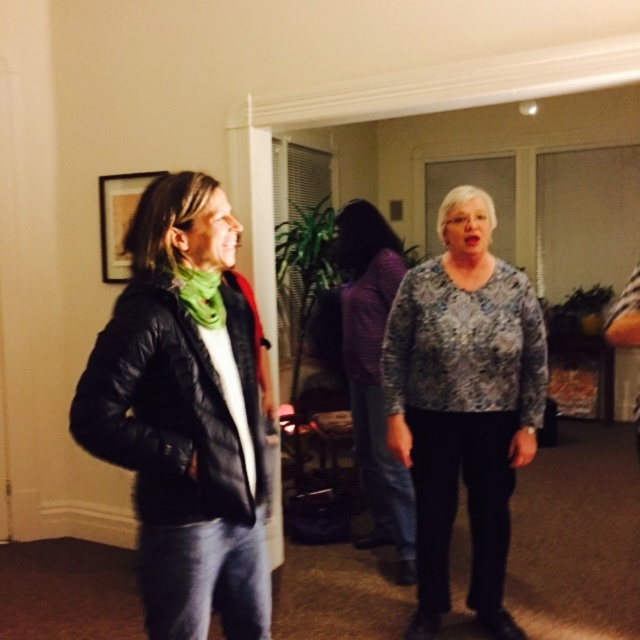
Based on the photo, based on the scene description, where exactly is the black quilted jacket at left located in the image?

The black quilted jacket at left is located at point coordinates of 0.647 on the x axis and 0.291 on the y axis.

You are planning to hang a picture frame on the wall between the black quilted jacket at left and the printed fabric blouse at center. The frame requires at least 1.2 meters of vertical space. Can the space between them accommodate the frame?

The black quilted jacket at left is shorter than the printed fabric blouse at center, but without specific height measurements for each object, it is impossible to determine if the vertical space between them is sufficient for the 1.2 meter requirement.